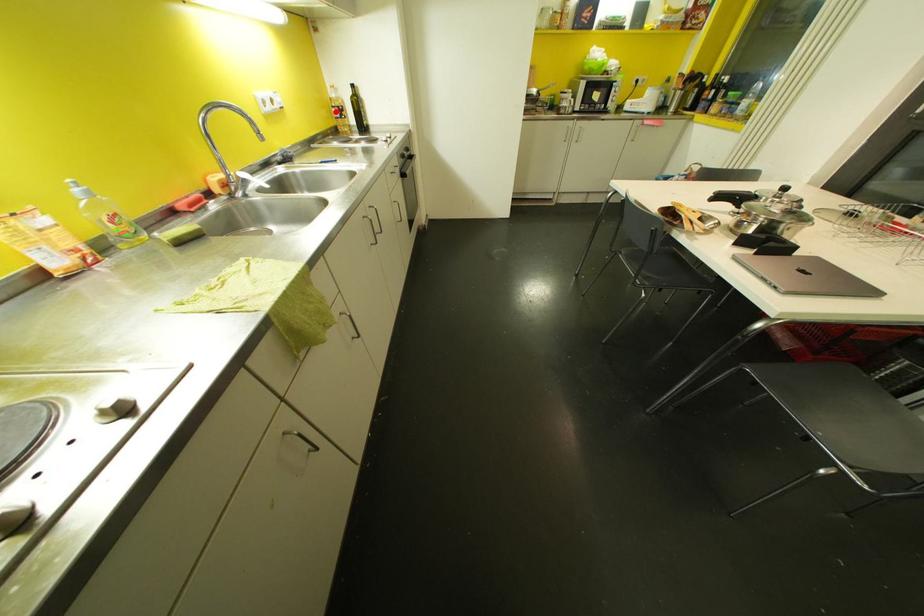
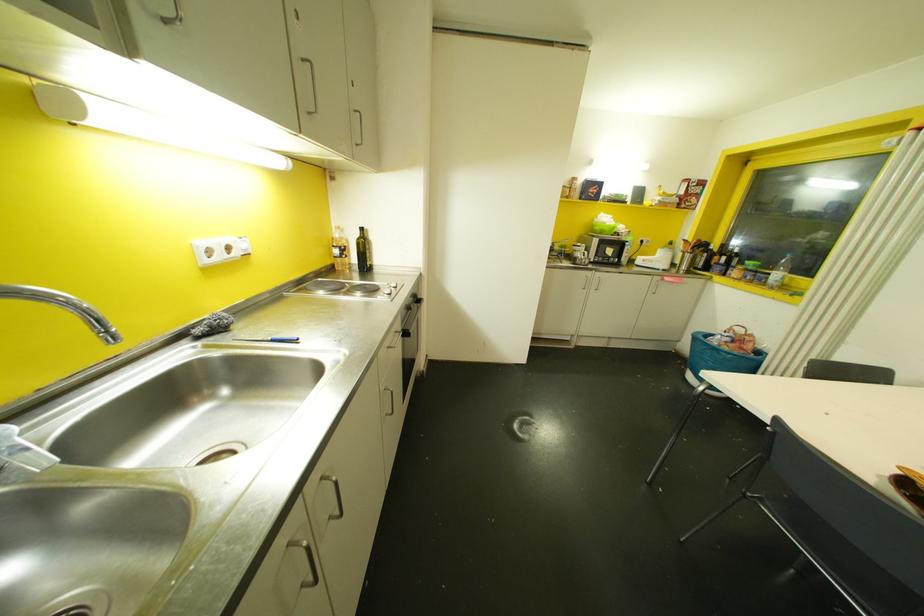
Locate, in the second image, the point that corresponds to the highlighted location in the first image.

(335, 251)